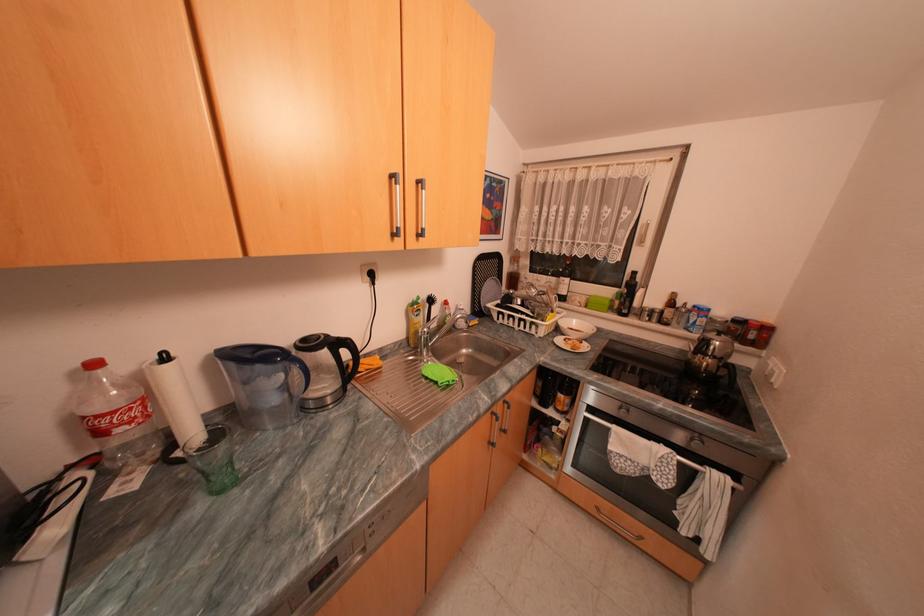
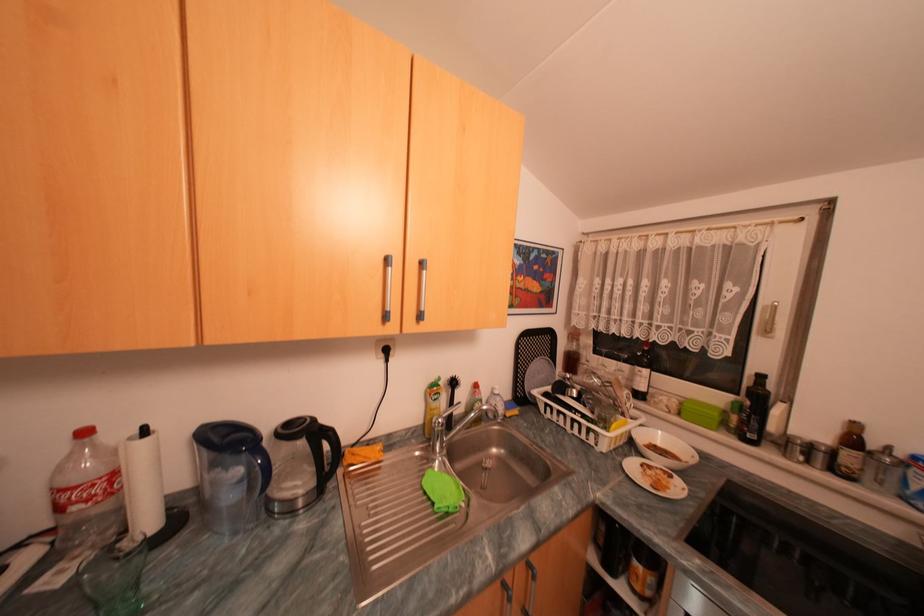
Find the pixel in the second image that matches the point at 563,278 in the first image.

(636, 366)